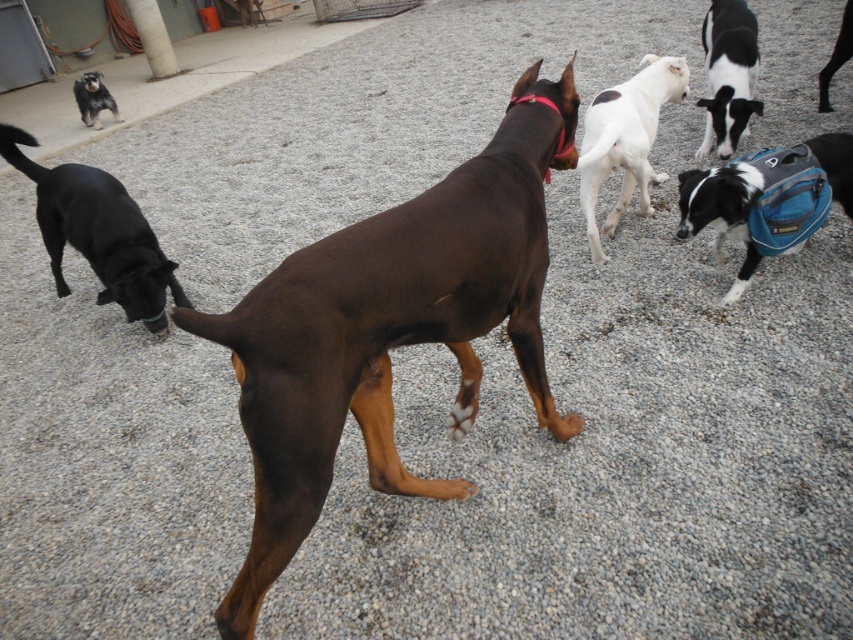
The image size is (853, 640). I want to click on black/white fur at right, so click(767, 198).

Consider the image. Measure the distance between black/white fur at right and black smooth dog at left.

The distance of black/white fur at right from black smooth dog at left is 8.90 feet.

Where is `black/white fur at right`? This screenshot has height=640, width=853. black/white fur at right is located at coordinates (767, 198).

Who is higher up, black and white fur at upper right or black smooth coat at upper right?

black smooth coat at upper right

From the picture: Between black and white fur at upper right and black smooth coat at upper right, which one has less height?

black smooth coat at upper right is shorter.

This screenshot has width=853, height=640. Describe the element at coordinates (728, 74) in the screenshot. I see `black and white fur at upper right` at that location.

The width and height of the screenshot is (853, 640). In order to click on black and white fur at upper right in this screenshot , I will do (x=728, y=74).

Is point (73, 198) farther from viewer compared to point (610, 212)?

That is False.

Does point (111, 253) lie behind point (590, 180)?

Yes.

Image resolution: width=853 pixels, height=640 pixels. What are the coordinates of `black smooth dog at left` in the screenshot? It's located at (97, 232).